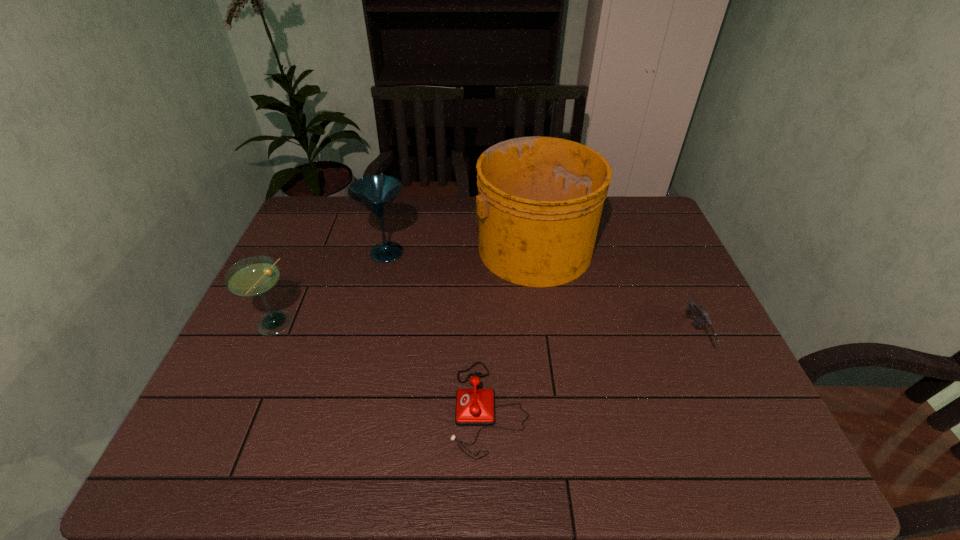
Locate an element on the screen. The image size is (960, 540). vacant space located 0.250m on the front of the right martini is located at coordinates (368, 334).

Find the location of `vacant space located on the front of the leftmost object`. vacant space located on the front of the leftmost object is located at coordinates (253, 371).

Locate an element on the screen. The width and height of the screenshot is (960, 540). vacant area situated at the barrel of the second shortest object is located at coordinates (743, 440).

Identify the location of vacant space situated 0.340m on the dial of the telephone. (298, 408).

Locate an element on the screen. Image resolution: width=960 pixels, height=540 pixels. blank area located on the dial of the telephone is located at coordinates (389, 408).

You are a GUI agent. You are given a task and a screenshot of the screen. Output one action in this format:
    pyautogui.click(x=<x>, y=<y>)
    Task: Click on the vacant space located 0.260m on the dial of the telephone
    The image size is (960, 540).
    Given the screenshot: What is the action you would take?
    pyautogui.click(x=334, y=408)

Find the location of a particular element. object positioned at the far edge is located at coordinates (539, 203).

I want to click on object that is at the near edge, so click(x=474, y=407).

I want to click on object located in the left edge section of the desktop, so click(x=255, y=276).

Find the location of a particular element. This screenshot has width=960, height=540. object that is at the right edge is located at coordinates (696, 310).